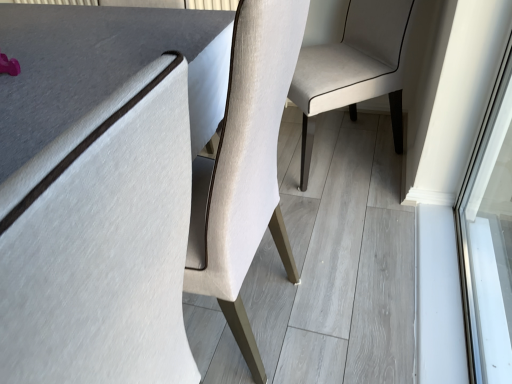
Where is `matte gray table at center`? The width and height of the screenshot is (512, 384). matte gray table at center is located at coordinates (100, 188).

Describe the element at coordinates (100, 188) in the screenshot. The height and width of the screenshot is (384, 512). I see `matte gray table at center` at that location.

This screenshot has height=384, width=512. What do you see at coordinates (354, 69) in the screenshot?
I see `light beige fabric chair at center` at bounding box center [354, 69].

You are a GUI agent. You are given a task and a screenshot of the screen. Output one action in this format:
    pyautogui.click(x=<x>, y=<y>)
    Task: Click on the light beige fabric chair at center
    
    Given the screenshot: What is the action you would take?
    pyautogui.click(x=354, y=69)

I want to click on matte gray table at center, so click(x=100, y=188).

Can you confirm if matte gray table at center is positioned to the right of light beige fabric chair at center?

No, matte gray table at center is not to the right of light beige fabric chair at center.

Which object is further away from the camera taking this photo, matte gray table at center or light beige fabric chair at center?

light beige fabric chair at center is further away from the camera.

Which is in front, point (4, 311) or point (362, 40)?

The point (4, 311) is closer to the camera.

From the image's perspective, who appears lower, matte gray table at center or light beige fabric chair at center?

matte gray table at center appears lower in the image.

From a real-world perspective, is matte gray table at center located beneath light beige fabric chair at center?

No.

Is matte gray table at center wider or thinner than light beige fabric chair at center?

Clearly, matte gray table at center has less width compared to light beige fabric chair at center.

Does matte gray table at center have a lesser height compared to light beige fabric chair at center?

In fact, matte gray table at center may be taller than light beige fabric chair at center.

Between matte gray table at center and light beige fabric chair at center, which one has smaller size?

matte gray table at center.

Is matte gray table at center spatially inside light beige fabric chair at center, or outside of it?

matte gray table at center exists outside the volume of light beige fabric chair at center.

Is matte gray table at center with light beige fabric chair at center?

No, matte gray table at center is not next to light beige fabric chair at center.

Is matte gray table at center turned away from light beige fabric chair at center?

No, matte gray table at center is not facing the opposite direction of light beige fabric chair at center.

How many degrees apart are the facing directions of matte gray table at center and light beige fabric chair at center?

There is a 38.9-degree angle between the facing directions of matte gray table at center and light beige fabric chair at center.

Measure the distance between matte gray table at center and light beige fabric chair at center.

matte gray table at center is 29.21 inches from light beige fabric chair at center.

Where is `table that appears below the light beige fabric chair at center (from the image's perspective)`? The width and height of the screenshot is (512, 384). table that appears below the light beige fabric chair at center (from the image's perspective) is located at coordinates (100, 188).

Considering the relative positions of light beige fabric chair at center and matte gray table at center in the image provided, is light beige fabric chair at center to the left of matte gray table at center from the viewer's perspective?

Incorrect, light beige fabric chair at center is not on the left side of matte gray table at center.

Considering the positions of objects light beige fabric chair at center and matte gray table at center in the image provided, who is behind, light beige fabric chair at center or matte gray table at center?

light beige fabric chair at center is further from the camera.

Does point (373, 24) lie in front of point (90, 80)?

That is False.

From the image's perspective, which one is positioned higher, light beige fabric chair at center or matte gray table at center?

light beige fabric chair at center is shown above in the image.

From a real-world perspective, is light beige fabric chair at center physically located above or below matte gray table at center?

Clearly, from a real-world perspective, light beige fabric chair at center is below matte gray table at center.

Is light beige fabric chair at center wider or thinner than matte gray table at center?

In the image, light beige fabric chair at center appears to be wider than matte gray table at center.

Between light beige fabric chair at center and matte gray table at center, which one has less height?

light beige fabric chair at center is shorter.

Is light beige fabric chair at center bigger than matte gray table at center?

Correct, light beige fabric chair at center is larger in size than matte gray table at center.

Does light beige fabric chair at center contain matte gray table at center?

Actually, matte gray table at center is outside light beige fabric chair at center.

Is light beige fabric chair at center directly adjacent to matte gray table at center?

There is a gap between light beige fabric chair at center and matte gray table at center.

Could you tell me if light beige fabric chair at center is facing matte gray table at center?

No, light beige fabric chair at center does not turn towards matte gray table at center.

From the picture: Measure the distance between light beige fabric chair at center and matte gray table at center.

light beige fabric chair at center is 29.21 inches away from matte gray table at center.

Find the location of a particular element. This screenshot has height=384, width=512. chair above the matte gray table at center (from the image's perspective) is located at coordinates (354, 69).

The width and height of the screenshot is (512, 384). What are the coordinates of `table in front of the light beige fabric chair at center` in the screenshot? It's located at (100, 188).

Locate an element on the screen. The image size is (512, 384). chair below the matte gray table at center (from a real-world perspective) is located at coordinates (354, 69).